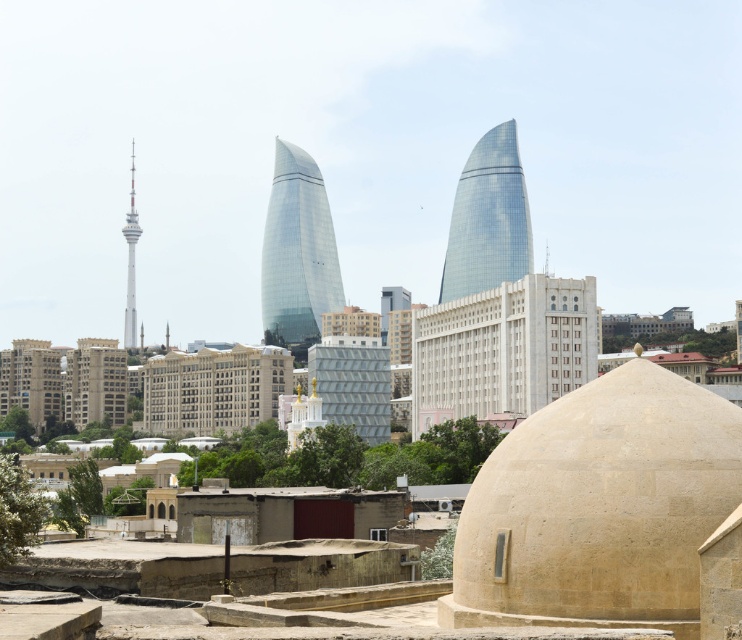
You are a drone operator planning to fly a drone from your current position to capture aerial footage of the transparent glass tower at center. The drone has a maximum flight range of 500 meters. Can the drone reach the tower without exceeding its range limit?

The transparent glass tower at center is 451.82 meters away from the camera. Since the drone can fly up to 500 meters, it can safely reach the tower without exceeding its range limit.

You are a city planner reviewing the architectural plans and see the transparent glass tower at center and the glassy blue tower at center. Which one is located more to the left side?

The transparent glass tower at center is positioned on the left side of glassy blue tower at center, so it is more to the left.

You are an architect planning to install a large statue in the city square. The statue requires a base that must be wider than the beige stone dome at center but narrower than the transparent glass tower at center. Is this feasible given their widths?

The beige stone dome at center has a lesser width compared to the transparent glass tower at center. Therefore, it is feasible to create a base wider than the beige stone dome at center but narrower than the transparent glass tower at center since there is a width difference between them.